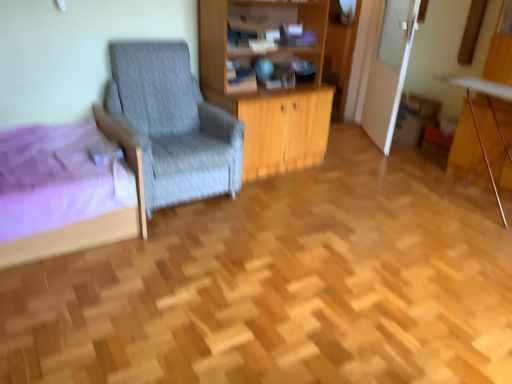
The height and width of the screenshot is (384, 512). I want to click on free area in between purple fabric bed at lower left and wooden desk at right, so click(323, 208).